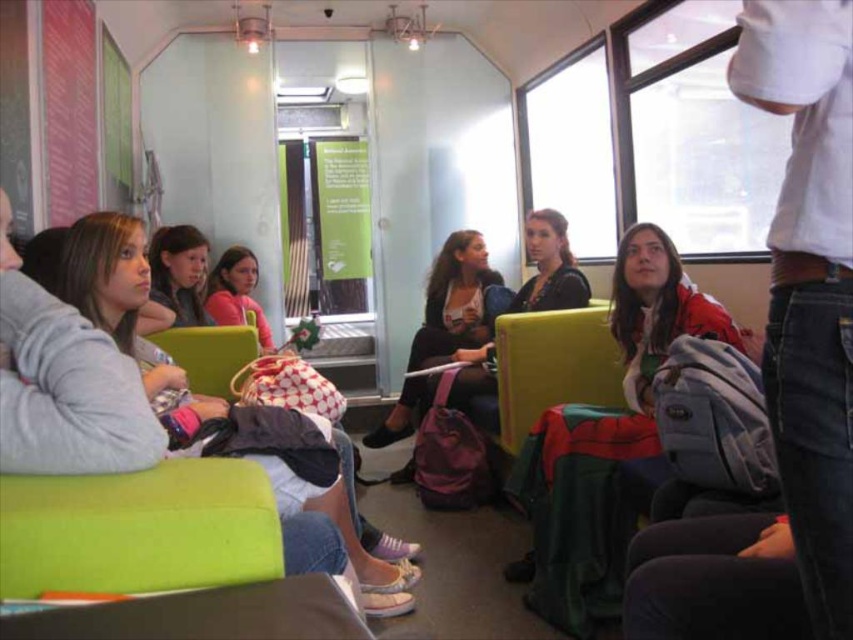
You are a passenger on this train and need to place your items on the seat next to you. The seat has limited space. Based on the image, which item between the matte black backpack at center and the matte pink sweater at center takes up more horizontal space?

The matte black backpack at center is wider than the matte pink sweater at center, so it takes up more horizontal space.

Imagine you are standing at the point marked by coordinates point (393, 404) and want to walk to the exit located at point (102, 285). Based on the scene description, which direction should you move to reach the exit?

You should move forward because point (102, 285) is in front of point (393, 404).

You are a passenger on this train and need to retrieve your matte gray hoodie at left and matte black backpack at center. Which item is closer to the left side of the train?

The matte gray hoodie at left is closer to the left side of the train since it is positioned to the left of the matte black backpack at center.